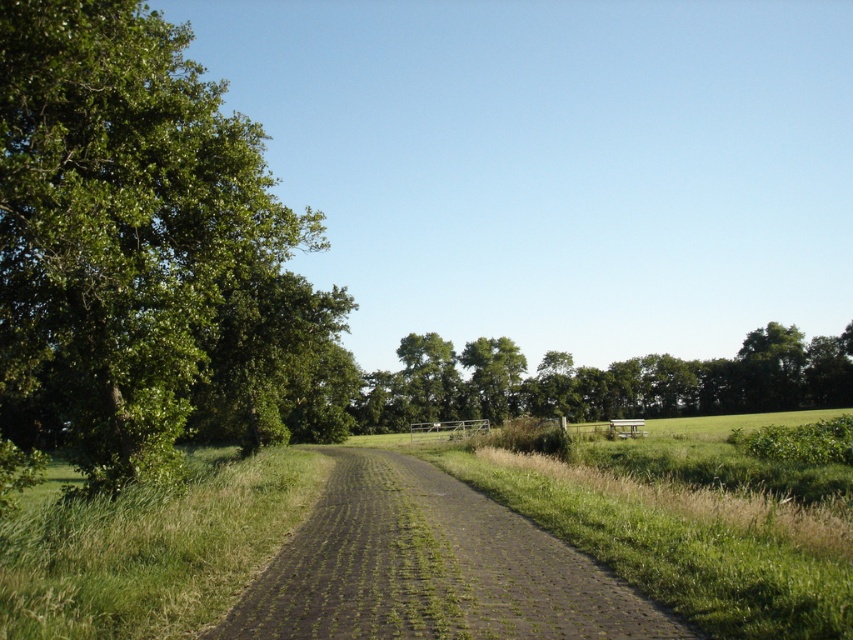
Based on the photo, can you confirm if green leafy tree at left is wider than green leafy tree at center?

Yes.

Between point (137, 144) and point (518, 364), which one is positioned in front?

Point (137, 144) is more forward.

Does point (78, 13) come closer to viewer compared to point (508, 401)?

Yes.

You are a GUI agent. You are given a task and a screenshot of the screen. Output one action in this format:
    pyautogui.click(x=<x>, y=<y>)
    Task: Click on the green leafy tree at left
    This screenshot has height=640, width=853.
    Given the screenshot: What is the action you would take?
    pyautogui.click(x=148, y=256)

Is point (146, 16) positioned in front of point (422, 584)?

No.

Who is more forward, (195, 209) or (387, 529)?

Positioned in front is point (387, 529).

Who is more forward, (154, 112) or (511, 628)?

Positioned in front is point (511, 628).

Where is `green leafy tree at left`? The height and width of the screenshot is (640, 853). green leafy tree at left is located at coordinates (148, 256).

Which is more to the left, dull brown dirt track at center or green leafy tree at center?

dull brown dirt track at center is more to the left.

Which is in front, point (567, 612) or point (494, 340)?

Point (567, 612) is more forward.

You are a GUI agent. You are given a task and a screenshot of the screen. Output one action in this format:
    pyautogui.click(x=<x>, y=<y>)
    Task: Click on the dull brown dirt track at center
    Image resolution: width=853 pixels, height=640 pixels.
    Given the screenshot: What is the action you would take?
    pyautogui.click(x=430, y=568)